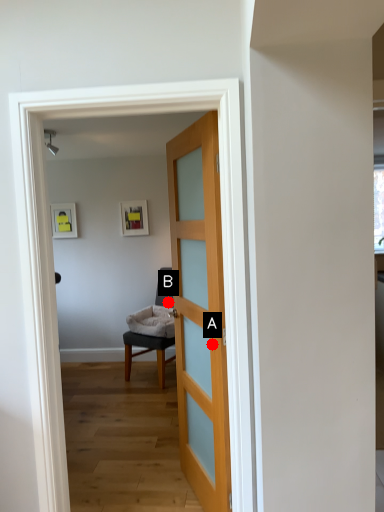
Question: Two points are circled on the image, labeled by A and B beside each circle. Which point is farther to the camera?

Choices:
 (A) A is further
 (B) B is further

Answer: (B)